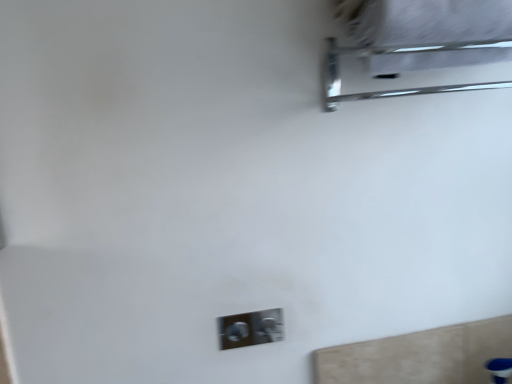
Question: Choose the correct answer: Is metallic chrome towel rack at upper right inside satin silver switch at lower center or outside it?

Choices:
 (A) inside
 (B) outside

Answer: (B)

Question: Looking at the image, does metallic chrome towel rack at upper right seem bigger or smaller compared to satin silver switch at lower center?

Choices:
 (A) small
 (B) big

Answer: (B)

Question: Is metallic chrome towel rack at upper right taller or shorter than satin silver switch at lower center?

Choices:
 (A) tall
 (B) short

Answer: (A)

Question: Is satin silver switch at lower center spatially inside metallic chrome towel rack at upper right, or outside of it?

Choices:
 (A) inside
 (B) outside

Answer: (B)

Question: From a real-world perspective, relative to metallic chrome towel rack at upper right, is satin silver switch at lower center vertically above or below?

Choices:
 (A) above
 (B) below

Answer: (B)

Question: From their relative heights in the image, would you say satin silver switch at lower center is taller or shorter than metallic chrome towel rack at upper right?

Choices:
 (A) tall
 (B) short

Answer: (B)

Question: Based on their sizes in the image, would you say satin silver switch at lower center is bigger or smaller than metallic chrome towel rack at upper right?

Choices:
 (A) small
 (B) big

Answer: (A)